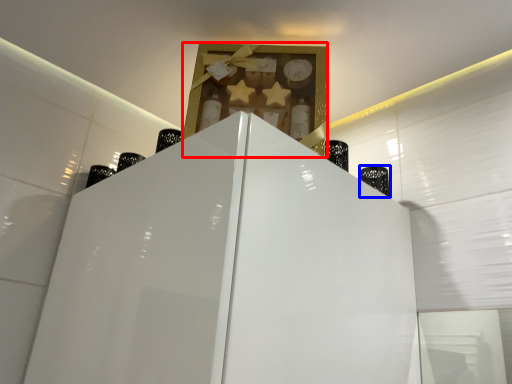
Question: Among these objects, which one is farthest to the camera, cabinet (highlighted by a red box) or bottle (highlighted by a blue box)?

Choices:
 (A) cabinet
 (B) bottle

Answer: (B)